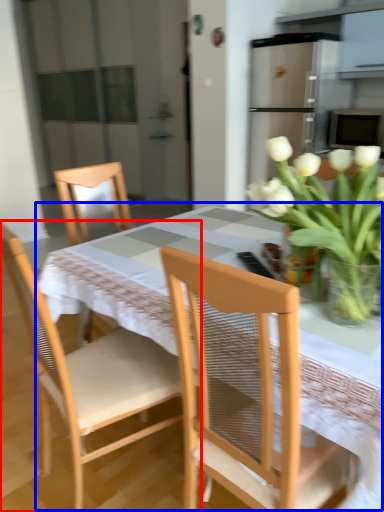
Question: Which object appears closest to the camera in this image, chair (highlighted by a red box) or kitchen & dining room table (highlighted by a blue box)?

Choices:
 (A) chair
 (B) kitchen & dining room table

Answer: (B)